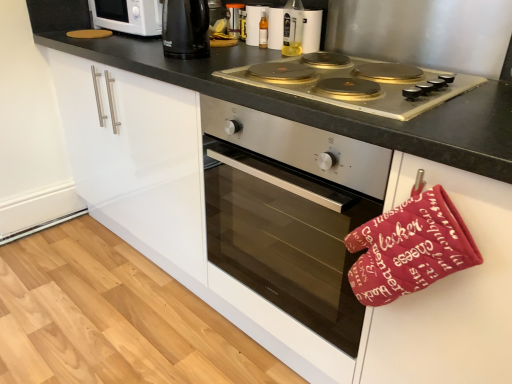
Question: Considering the positions of stainless steel oven at center and gold-coated stovetop at center in the image, is stainless steel oven at center wider or thinner than gold-coated stovetop at center?

Choices:
 (A) thin
 (B) wide

Answer: (B)

Question: From a real-world perspective, is stainless steel oven at center physically located above or below gold-coated stovetop at center?

Choices:
 (A) above
 (B) below

Answer: (B)

Question: Based on their relative distances, which object is nearer to the white glossy microwave at upper left?

Choices:
 (A) white glossy oven at center
 (B) black plastic kettle at upper center
 (C) translucent glass bottle at upper center
 (D) translucent plastic bottle at upper center, which is the 1th bottle in right-to-left order
 (E) gold-coated stovetop at center

Answer: (B)

Question: Which is farther from the translucent glass bottle at center, the 1th bottle positioned from the left?

Choices:
 (A) translucent plastic bottle at upper center, which is the second bottle from left to right
 (B) white glossy microwave at upper left
 (C) black plastic kettle at upper center
 (D) translucent glass bottle at upper center
 (E) white glossy oven at center

Answer: (E)